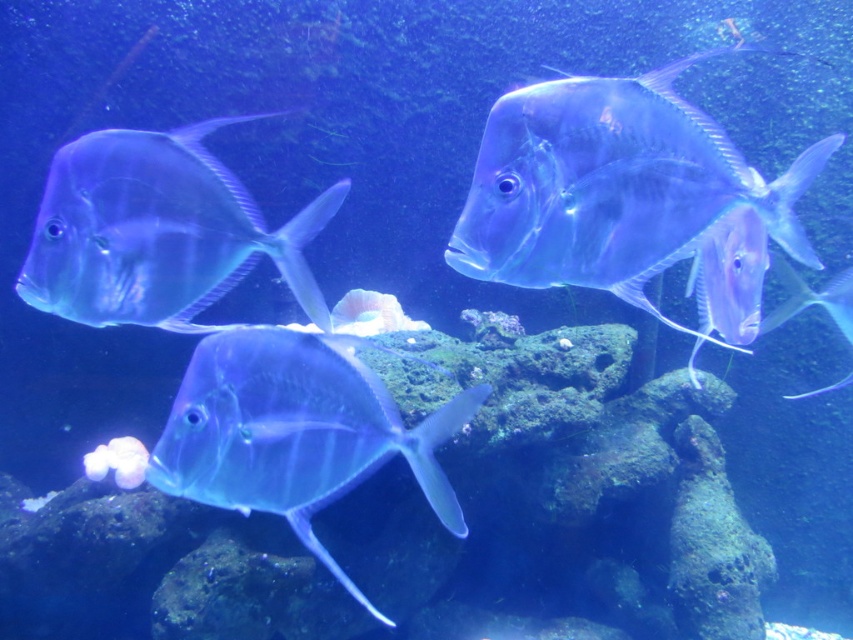
You are an underwater photographer aiming to capture a closeup shot of both the translucent blue fish at left and the translucent glassy fish at right. Given their sizes, which fish would require you to position your camera closer to get a similar sized image in the frame?

The translucent glassy fish at right is smaller in size compared to the translucent blue fish at left. To capture them at a similar size in the frame, you would need to position the camera closer to the translucent glassy fish at right.

You are an underwater photographer aiming to capture a clear shot of the translucent glass fish at upper center. You are positioned at the point marked by coordinates point [628,196]. Can you determine if you are directly above the fish or positioned to its side?

The point [628,196] marks the translucent glass fish at upper center, so you are directly above the fish.

You are a marine biologist observing the underwater scene. You notice two points marked in the image. Which point is closer to you, point (602,168) or point (834,278)?

Point (602,168) is closer to the viewer than point (834,278).